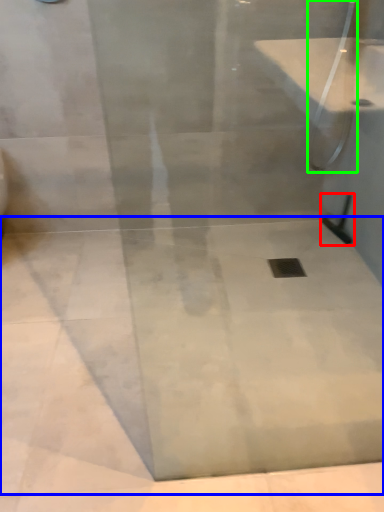
Question: Which is farther away from shower (highlighted by a red box)? concrete (highlighted by a blue box) or shower (highlighted by a green box)?

Choices:
 (A) concrete
 (B) shower

Answer: (A)